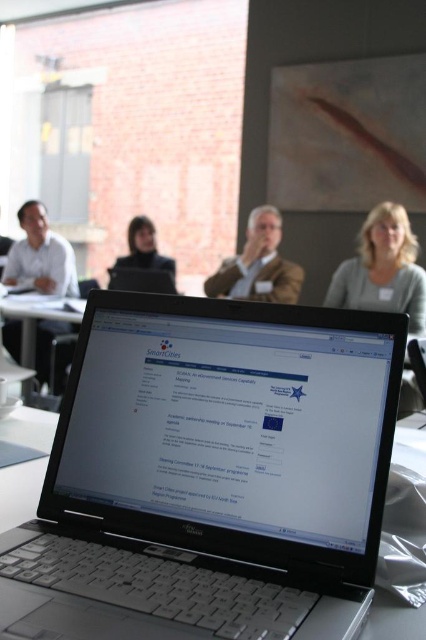
Who is positioned more to the left, matte white shirt at left or matte black laptop at center?

Positioned to the left is matte white shirt at left.

Between point (40, 285) and point (149, 227), which one is positioned in front?

Positioned in front is point (40, 285).

Identify the location of matte white shirt at left. (40, 256).

Can you confirm if light gray sweater at upper right is positioned above matte white shirt at left?

No.

Between light gray sweater at upper right and matte white shirt at left, which one is positioned lower?

light gray sweater at upper right is below.

Identify the location of light gray sweater at upper right. This screenshot has width=426, height=640. click(x=382, y=269).

Locate an element on the screen. Image resolution: width=426 pixels, height=640 pixels. light gray sweater at upper right is located at coordinates (382, 269).

Which is behind, point (416, 308) or point (169, 273)?

Point (169, 273)

Is point (374, 221) less distant than point (167, 262)?

That is True.

Where is `light gray sweater at upper right`? The width and height of the screenshot is (426, 640). light gray sweater at upper right is located at coordinates (382, 269).